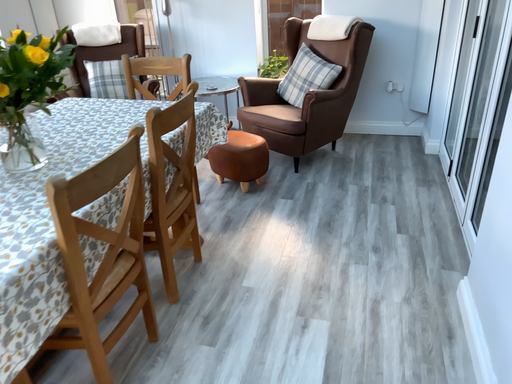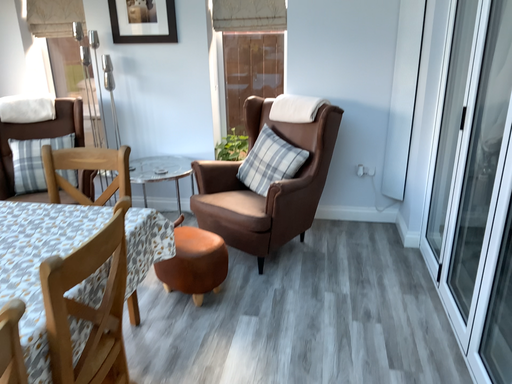
Question: How did the camera likely rotate when shooting the video?

Choices:
 (A) rotated upward
 (B) rotated downward

Answer: (A)